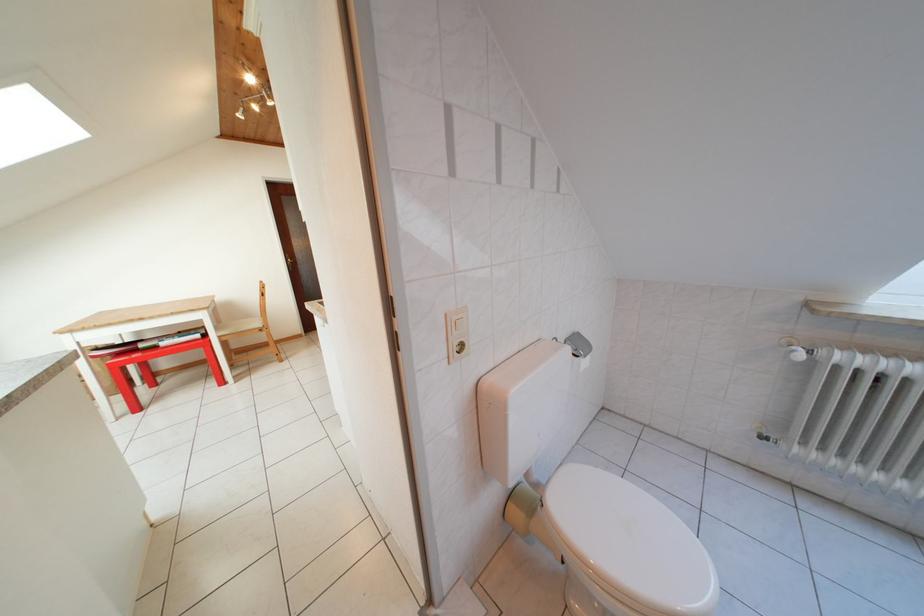
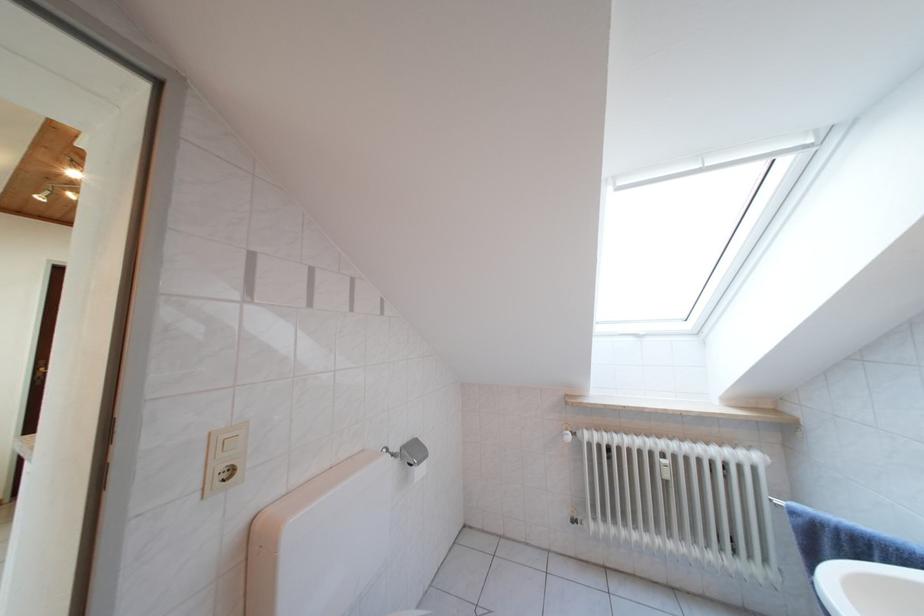
In the second image, find the point that corresponds to the point at 467,358 in the first image.

(232, 485)